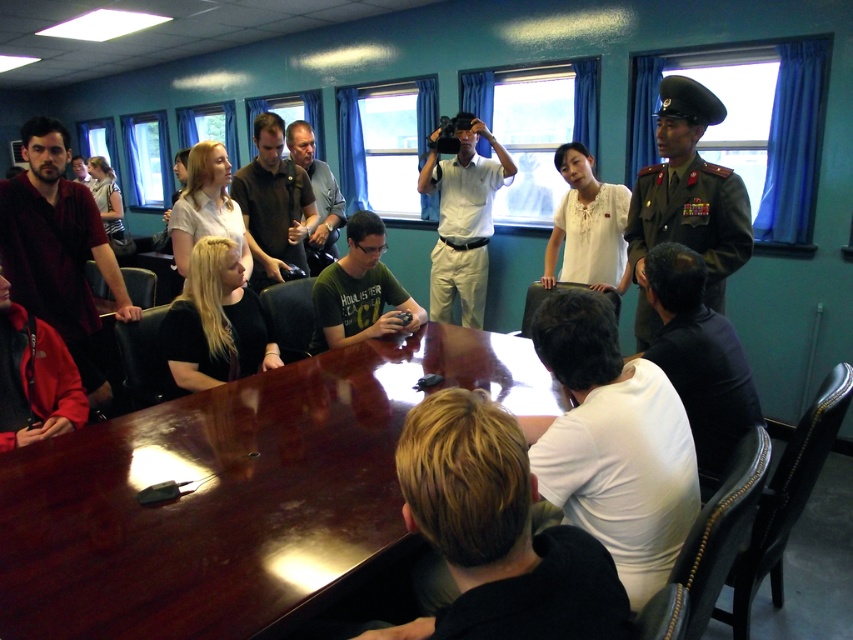
Question: Does green military uniform at right appear under matte black microphone at center?

Choices:
 (A) no
 (B) yes

Answer: (B)

Question: Which of these objects is positioned farthest from the green military uniform at right?

Choices:
 (A) matte black microphone at center
 (B) white cotton shirt at center
 (C) white matte shirt at lower center

Answer: (A)

Question: Estimate the real-world distances between objects in this image. Which object is farther from the dark blue fabric shirt at lower right?

Choices:
 (A) glossy wood table at center
 (B) green military uniform at right
 (C) matte black shirt at left

Answer: (C)

Question: Can you confirm if dark brown hair at center is positioned to the left of matte black microphone at center?

Choices:
 (A) no
 (B) yes

Answer: (A)

Question: Is green military uniform at right wider than matte black microphone at center?

Choices:
 (A) no
 (B) yes

Answer: (B)

Question: Which point is farther from the camera taking this photo?

Choices:
 (A) (433, 152)
 (B) (71, 620)
 (C) (740, 397)

Answer: (A)